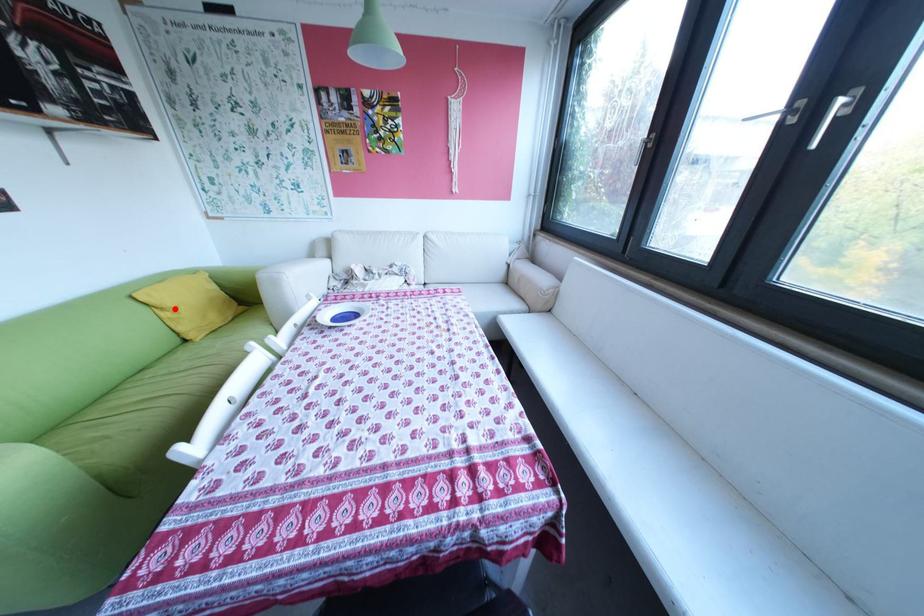
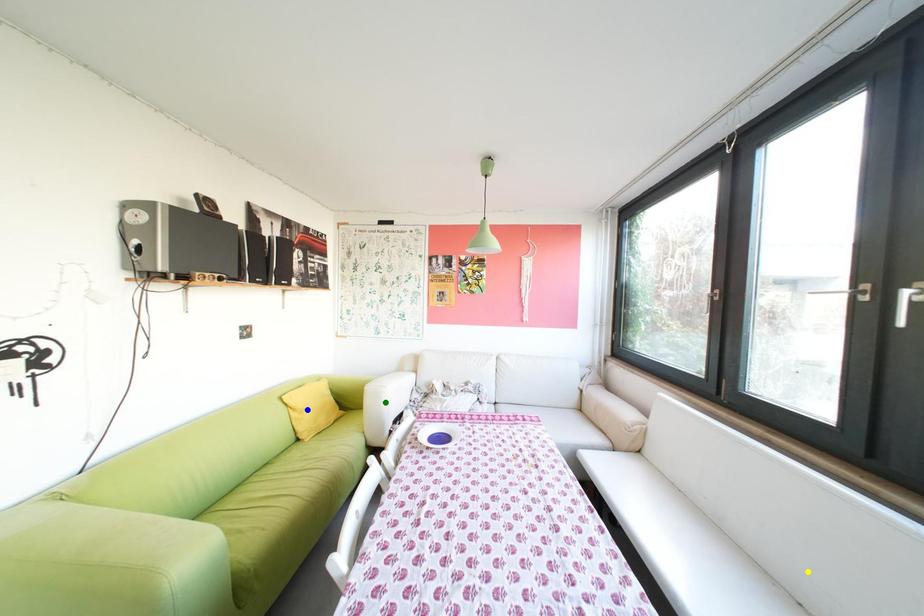
Question: I am providing you with two images of the same scene from different viewpoints. A red point is marked on the first image. You are given multiple points on the second image. In image 2, which mark is for the same physical point as the one in image 1?

Choices:
 (A) green point
 (B) blue point
 (C) yellow point

Answer: (B)